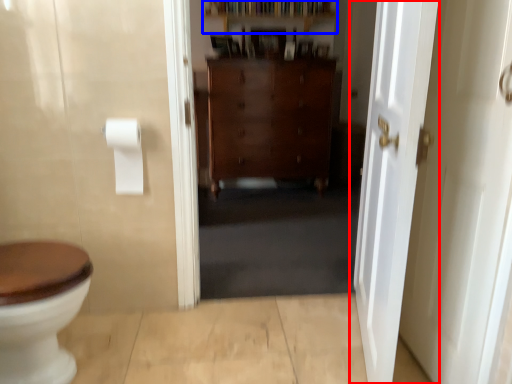
Question: Which of the following is the closest to the observer, door (highlighted by a red box) or shelf (highlighted by a blue box)?

Choices:
 (A) door
 (B) shelf

Answer: (A)